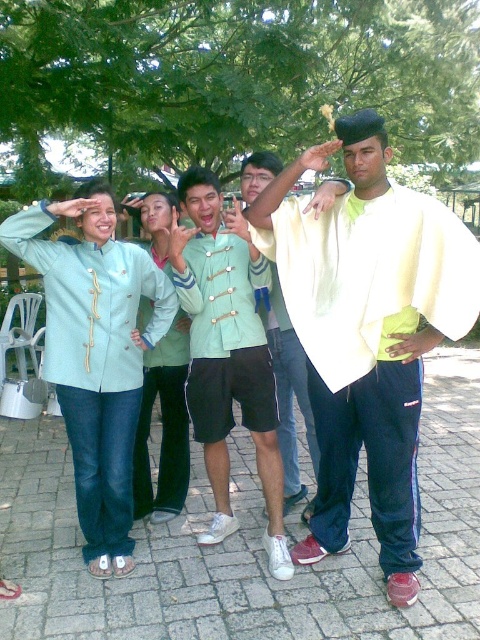
Question: Observing the image, what is the correct spatial positioning of matte green uniform at center in reference to light green fabric shirt at center?

Choices:
 (A) below
 (B) above

Answer: (B)

Question: From the image, what is the correct spatial relationship of light yellow fabric shirt at center in relation to matte green jacket at left?

Choices:
 (A) right
 (B) left

Answer: (A)

Question: Which of the following is the farthest from the observer?

Choices:
 (A) light yellow fabric shirt at center
 (B) matte green uniform at center

Answer: (B)

Question: Does light yellow fabric shirt at center have a lesser width compared to light green fabric shirt at center?

Choices:
 (A) yes
 (B) no

Answer: (B)

Question: Based on their relative distances, which object is nearer to the matte green uniform at center?

Choices:
 (A) matte green jacket at left
 (B) light yellow fabric shirt at center
 (C) light green fabric shirt at center

Answer: (C)

Question: Considering the real-world distances, which object is farthest from the matte green jacket at left?

Choices:
 (A) light blue denim jacket at center
 (B) light yellow fabric shirt at center

Answer: (B)